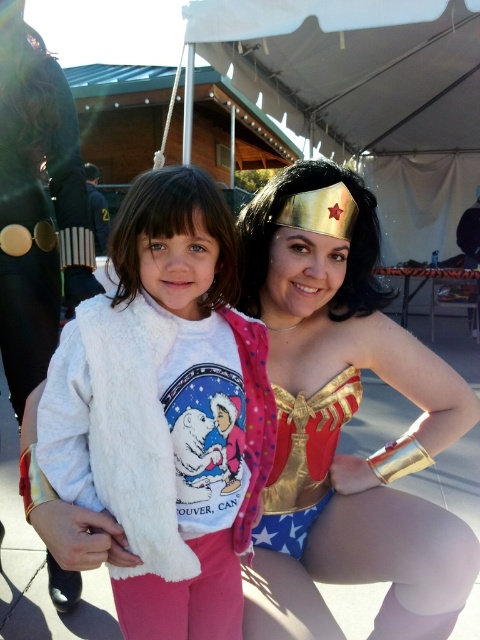
Which is above, gold metallic costume at center or white fluffy vest at center?

white fluffy vest at center is higher up.

Is gold metallic costume at center closer to the viewer compared to white fluffy vest at center?

No.

Identify the location of gold metallic costume at center. (340, 426).